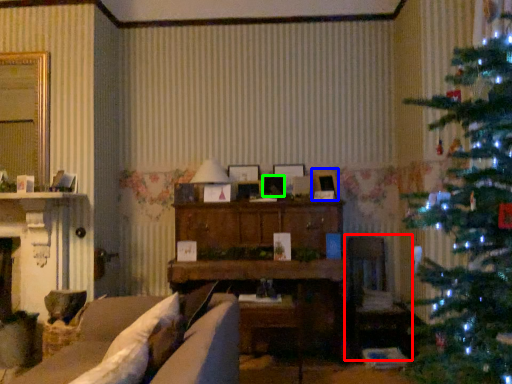
Question: Which object is positioned closest to armchair (highlighted by a red box)? Select from picture frame (highlighted by a blue box) and picture frame (highlighted by a green box).

Choices:
 (A) picture frame
 (B) picture frame

Answer: (A)